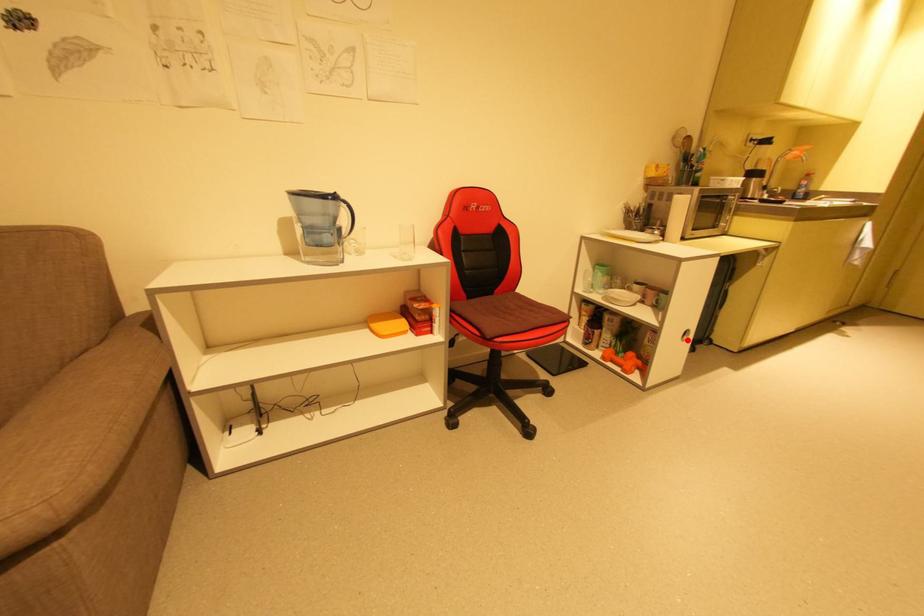
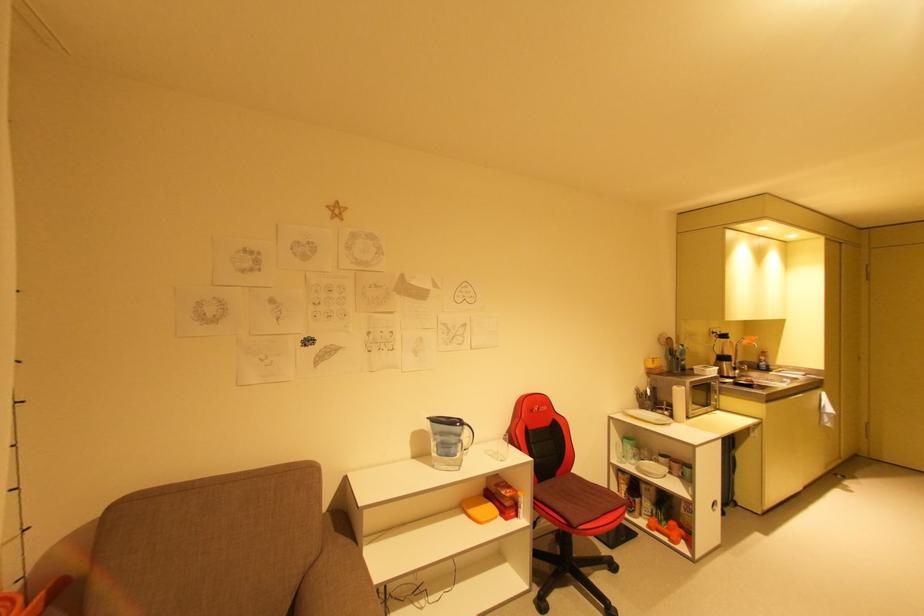
Find the pixel in the second image that matches the highlighted location in the first image.

(718, 511)